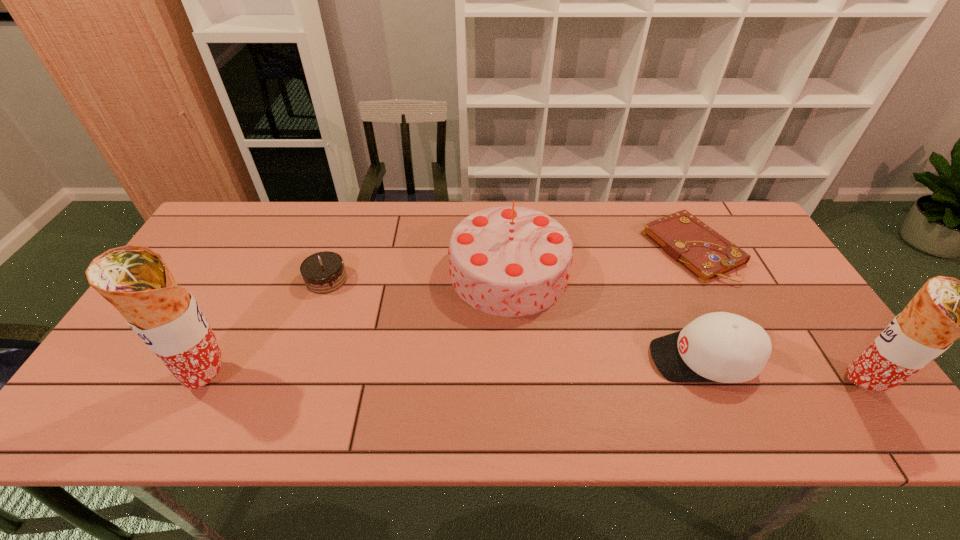
I want to click on vacant point that satisfies the following two spatial constraints: 1. on the back side of the fourth object from right to left; 2. on the left side of the fifth tallest object, so point(328,273).